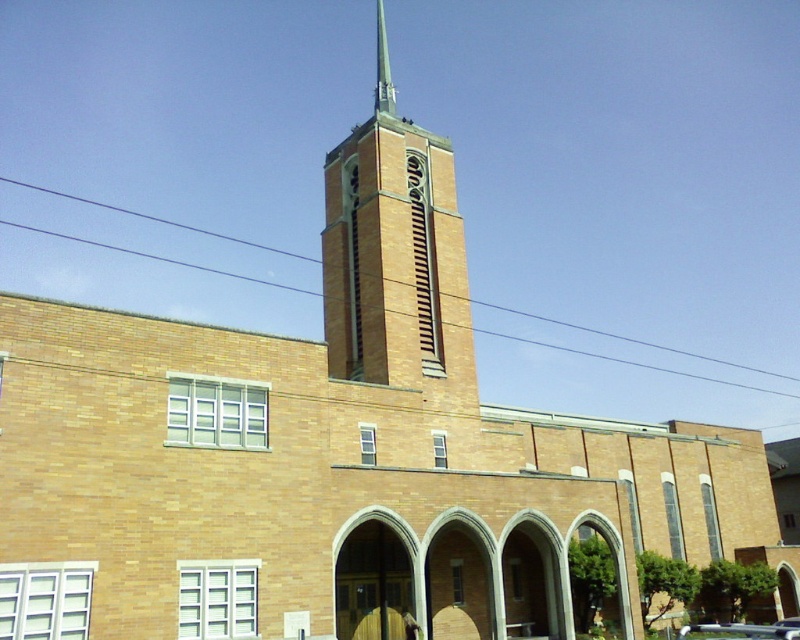
Based on the photo, you are an architect assessing the building structure. Based on the image, which object has a greater width between the brown brick tower at center and the green metallic spire at center top?

The brown brick tower at center has a greater width than the green metallic spire at center top.

You are standing in front of the brick building and want to place a small statue exactly halfway between point (432,177) and point (392,97). Will the statue be closer to the tower or the main building?

The statue placed halfway between point (432,177) and point (392,97) will be closer to the tower because point (432,177) is closer to the viewer than point (392,97).

You are a photographer planning to capture the green metallic spire at center top and the metallic silver car at lower right in a single frame. Given that the car is narrower than the spire, how should you position your camera to ensure both are fully visible?

Since the metallic silver car at lower right is narrower than the green metallic spire at center top, position the camera closer to the car to emphasize its width relative to the spire, ensuring both fit within the frame.